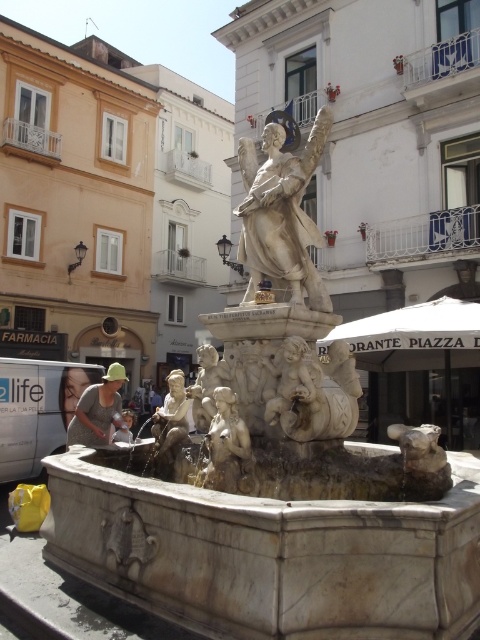
Question: Is white marble statue at center in front of smooth stone cherub at center?

Choices:
 (A) yes
 (B) no

Answer: (B)

Question: Which object is closer to the camera taking this photo?

Choices:
 (A) white marble cherubs at center
 (B) light brown fabric cap at lower left
 (C) white marble cherub at center

Answer: (C)

Question: Which point is closer to the camera?

Choices:
 (A) (x=189, y=403)
 (B) (x=96, y=380)

Answer: (A)

Question: Considering the relative positions of smooth stone cherub at center and matte white cherub at center in the image provided, where is smooth stone cherub at center located with respect to matte white cherub at center?

Choices:
 (A) right
 (B) left

Answer: (A)

Question: Is white marble statue at center further to camera compared to smooth beige cherub at center?

Choices:
 (A) yes
 (B) no

Answer: (B)

Question: Which point appears farthest from the camera in this image?

Choices:
 (A) 105,401
 (B) 182,394
 (C) 68,401
 (D) 203,401

Answer: (C)